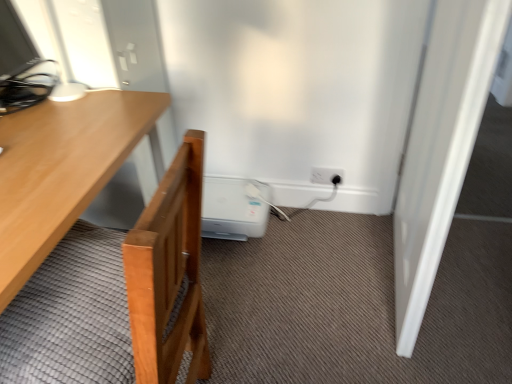
What are the coordinates of `vacant space in white smooth door at right (from a real-world perspective)` in the screenshot? It's located at (386, 268).